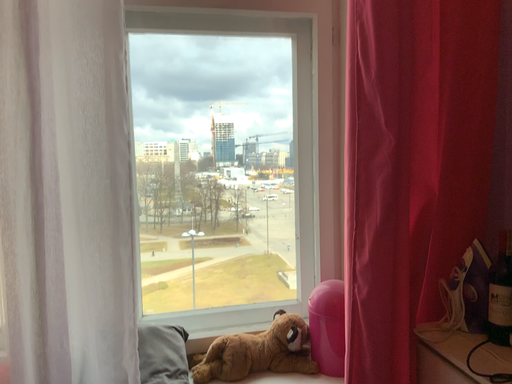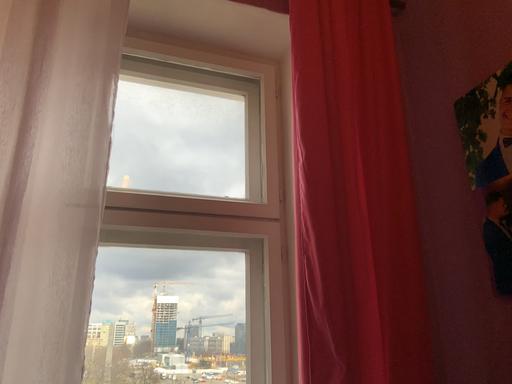
Question: Which way did the camera rotate in the video?

Choices:
 (A) rotated left
 (B) rotated right

Answer: (B)